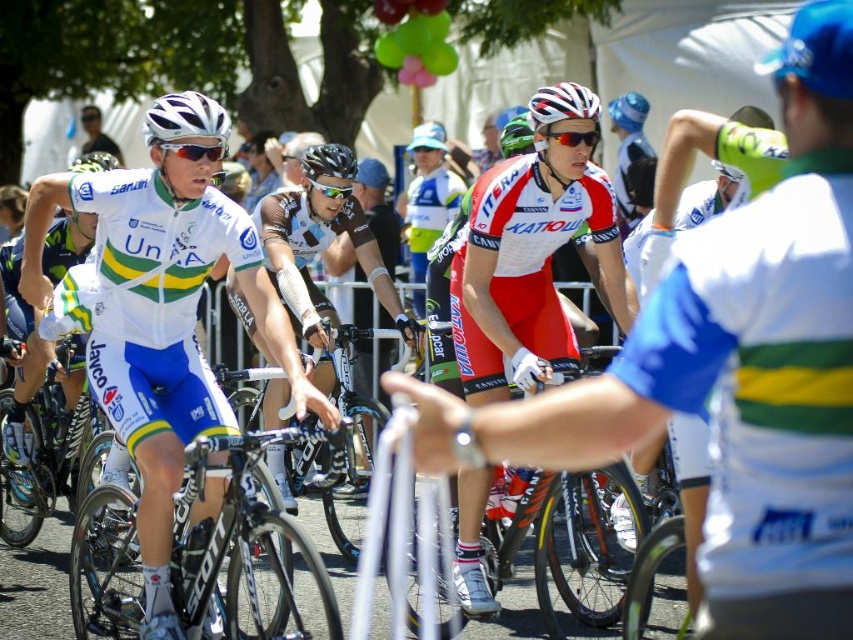
Consider the image. Does silver metallic bicycle at center appear under black matte bicycle helmet at center?

Correct, silver metallic bicycle at center is located below black matte bicycle helmet at center.

Measure the distance from silver metallic bicycle at center to black matte bicycle helmet at center.

silver metallic bicycle at center and black matte bicycle helmet at center are 12.52 feet apart.

Looking at this image, who is more distant from viewer, (332, 602) or (344, 166)?

Positioned behind is point (344, 166).

Find the location of a particular element. This screenshot has height=640, width=853. silver metallic bicycle at center is located at coordinates (248, 541).

Between point (165, 499) and point (543, 93), which one is positioned in front?

Point (165, 499) is more forward.

Describe the element at coordinates (161, 321) in the screenshot. I see `white matte jersey at center` at that location.

Between point (35, 248) and point (549, 93), which one is positioned in front?

Point (35, 248)

Where is `white matte jersey at center`? white matte jersey at center is located at coordinates (161, 321).

Can you confirm if white matte jersey at center is positioned above silver metallic bicycle at center?

Yes, white matte jersey at center is above silver metallic bicycle at center.

Is point (187, 138) behind point (74, 525)?

No, (187, 138) is closer to viewer.

The height and width of the screenshot is (640, 853). I want to click on white matte jersey at center, so click(x=161, y=321).